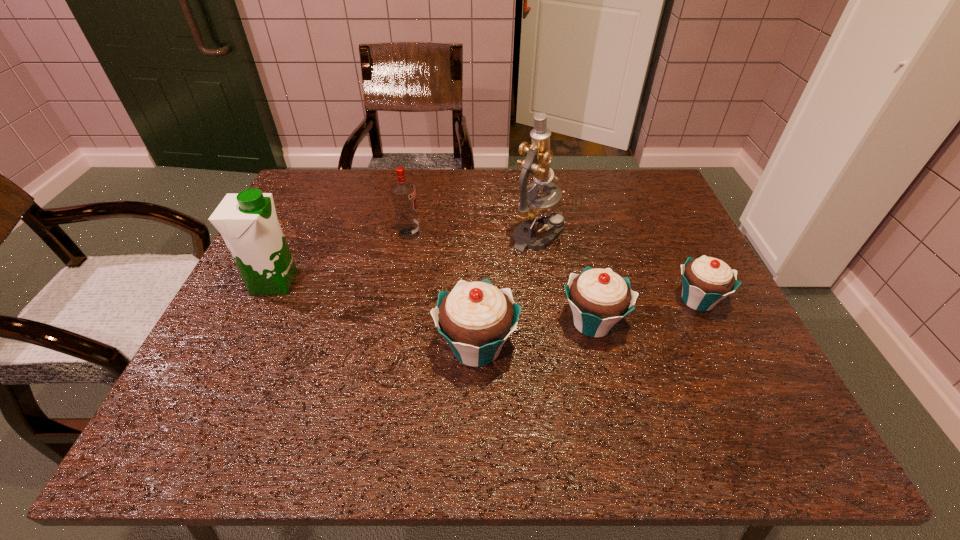
The height and width of the screenshot is (540, 960). Identify the location of vacant area in the image that satisfies the following two spatial constraints: 1. on the front label of the vodka; 2. on the left side of the second shortest cupcake. (393, 323).

At what (x,y) coordinates should I click in order to perform the action: click on free space that satisfies the following two spatial constraints: 1. on the front side of the tallest object; 2. on the left side of the fifth tallest object. Please return your answer as a coordinate pair (x, y). The width and height of the screenshot is (960, 540). Looking at the image, I should click on tap(551, 323).

This screenshot has width=960, height=540. In order to click on free location that satisfies the following two spatial constraints: 1. on the front label of the shortest cupcake; 2. on the right side of the vodka in this screenshot , I will do `click(396, 300)`.

This screenshot has width=960, height=540. Find the location of `vacant space that satisfies the following two spatial constraints: 1. on the front label of the vodka; 2. on the left side of the tallest object`. vacant space that satisfies the following two spatial constraints: 1. on the front label of the vodka; 2. on the left side of the tallest object is located at coordinates [409, 235].